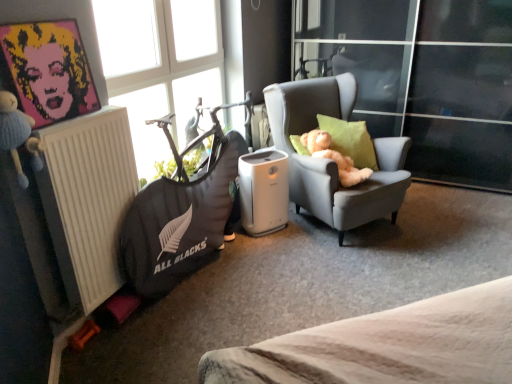
At what (x,y) coordinates should I click in order to perform the action: click on free location in front of dark gray fabric bean bag at left. Please return your answer as a coordinate pair (x, y). Looking at the image, I should click on (212, 316).